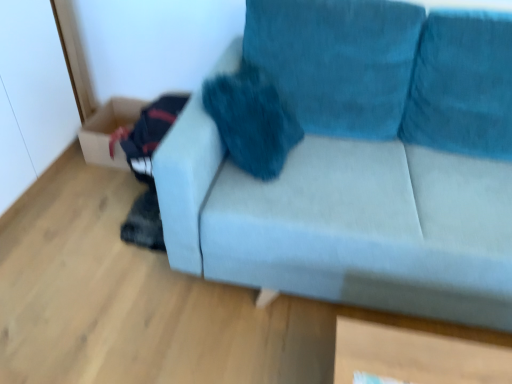
The height and width of the screenshot is (384, 512). Identify the location of cardboard box at lower left. (109, 131).

Image resolution: width=512 pixels, height=384 pixels. Describe the element at coordinates (109, 131) in the screenshot. I see `cardboard box at lower left` at that location.

Identify the location of velvet teal couch at center. Image resolution: width=512 pixels, height=384 pixels. (342, 221).

What is the approximate height of velvet teal couch at center?

35.44 inches.

What do you see at coordinates (342, 221) in the screenshot?
I see `velvet teal couch at center` at bounding box center [342, 221].

Find the location of a particular element. This screenshot has width=512, height=384. cardboard box at lower left is located at coordinates (109, 131).

Considering the relative positions of velvet teal couch at center and cardboard box at lower left in the image provided, is velvet teal couch at center to the left of cardboard box at lower left from the viewer's perspective?

No.

Which object is further away from the camera taking this photo, velvet teal couch at center or cardboard box at lower left?

cardboard box at lower left is behind.

Between point (272, 258) and point (93, 134), which one is positioned in front?

Point (272, 258)

From the image's perspective, does velvet teal couch at center appear higher than cardboard box at lower left?

No, from the image's perspective, velvet teal couch at center is not on top of cardboard box at lower left.

From a real-world perspective, between velvet teal couch at center and cardboard box at lower left, who is vertically lower?

cardboard box at lower left is physically lower.

Considering the sizes of velvet teal couch at center and cardboard box at lower left in the image, is velvet teal couch at center wider or thinner than cardboard box at lower left?

velvet teal couch at center is wider than cardboard box at lower left.

Does velvet teal couch at center have a lesser height compared to cardboard box at lower left?

Incorrect, the height of velvet teal couch at center does not fall short of that of cardboard box at lower left.

From the picture: Looking at the image, does velvet teal couch at center seem bigger or smaller compared to cardboard box at lower left?

In the image, velvet teal couch at center appears to be larger than cardboard box at lower left.

Is velvet teal couch at center surrounding cardboard box at lower left?

No, cardboard box at lower left is not inside velvet teal couch at center.

Does velvet teal couch at center touch cardboard box at lower left?

velvet teal couch at center and cardboard box at lower left are clearly separated.

Is velvet teal couch at center oriented towards cardboard box at lower left?

No, velvet teal couch at center is not facing towards cardboard box at lower left.

How different are the orientations of velvet teal couch at center and cardboard box at lower left in degrees?

There is a 1.24-degree angle between the facing directions of velvet teal couch at center and cardboard box at lower left.

Image resolution: width=512 pixels, height=384 pixels. In order to click on studio couch below the cardboard box at lower left (from the image's perspective) in this screenshot , I will do `click(342, 221)`.

Considering the relative positions of cardboard box at lower left and velvet teal couch at center in the image provided, is cardboard box at lower left to the right of velvet teal couch at center from the viewer's perspective?

Incorrect, cardboard box at lower left is not on the right side of velvet teal couch at center.

Considering the relative positions of cardboard box at lower left and velvet teal couch at center in the image provided, is cardboard box at lower left in front of velvet teal couch at center?

No.

Which is farther, (135, 116) or (434, 259)?

Positioned behind is point (135, 116).

From the image's perspective, would you say cardboard box at lower left is shown under velvet teal couch at center?

No.

From a real-world perspective, is cardboard box at lower left physically located above or below velvet teal couch at center?

In terms of real-world spatial position, cardboard box at lower left is below velvet teal couch at center.

Does cardboard box at lower left have a greater width compared to velvet teal couch at center?

In fact, cardboard box at lower left might be narrower than velvet teal couch at center.

In terms of height, does cardboard box at lower left look taller or shorter compared to velvet teal couch at center?

cardboard box at lower left is shorter than velvet teal couch at center.

Considering the sizes of objects cardboard box at lower left and velvet teal couch at center in the image provided, who is smaller, cardboard box at lower left or velvet teal couch at center?

Smaller between the two is cardboard box at lower left.

Is cardboard box at lower left located outside velvet teal couch at center?

Yes, cardboard box at lower left is located beyond the bounds of velvet teal couch at center.

Is cardboard box at lower left not near velvet teal couch at center?

Absolutely, cardboard box at lower left is distant from velvet teal couch at center.

Based on the photo, could you tell me if cardboard box at lower left is turned towards velvet teal couch at center?

No, cardboard box at lower left is not oriented towards velvet teal couch at center.

This screenshot has width=512, height=384. Find the location of `studio couch on the right of cardboard box at lower left`. studio couch on the right of cardboard box at lower left is located at coordinates (342, 221).

Locate an element on the screen. studio couch below the cardboard box at lower left (from the image's perspective) is located at coordinates (342, 221).

The width and height of the screenshot is (512, 384). What are the coordinates of `studio couch on the right of cardboard box at lower left` in the screenshot? It's located at (342, 221).